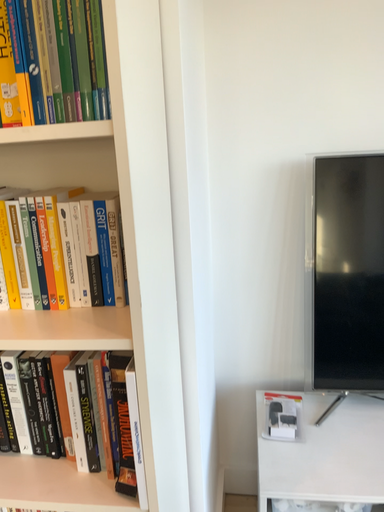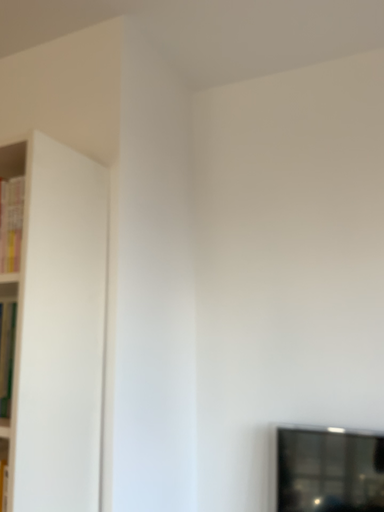
Question: Which way did the camera rotate in the video?

Choices:
 (A) rotated left
 (B) rotated right

Answer: (A)